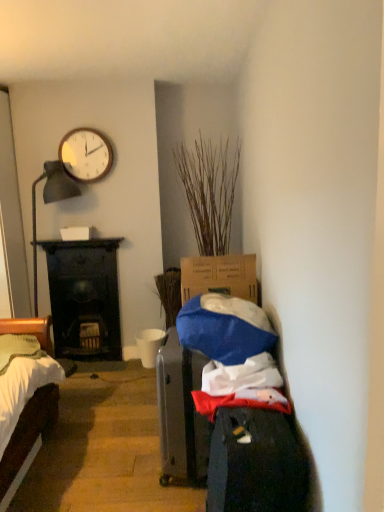
What do you see at coordinates (86, 155) in the screenshot? I see `wooden clock at upper left` at bounding box center [86, 155].

Where is `dark wood fireplace at left`? This screenshot has height=512, width=384. dark wood fireplace at left is located at coordinates (84, 295).

The width and height of the screenshot is (384, 512). Find the location of `wooden clock at upper left`. wooden clock at upper left is located at coordinates (86, 155).

In terms of height, does white matte cup at center look taller or shorter compared to dark wood fireplace at left?

In the image, white matte cup at center appears to be shorter than dark wood fireplace at left.

Is the surface of white matte cup at center in direct contact with dark wood fireplace at left?

No, white matte cup at center is not in contact with dark wood fireplace at left.

How different are the orientations of white matte cup at center and dark wood fireplace at left in degrees?

The facing directions of white matte cup at center and dark wood fireplace at left are 0.512 degrees apart.

From the image's perspective, who appears lower, white matte cup at center or dark wood fireplace at left?

white matte cup at center, from the image's perspective.

Could you tell me if dark wood fireplace at left is turned towards wooden clock at upper left?

No, dark wood fireplace at left is not oriented towards wooden clock at upper left.

Is the surface of dark wood fireplace at left in direct contact with wooden clock at upper left?

No, dark wood fireplace at left is not making contact with wooden clock at upper left.

Does dark wood fireplace at left appear on the left side of wooden clock at upper left?

Indeed, dark wood fireplace at left is positioned on the left side of wooden clock at upper left.

Is dark wood fireplace at left wider or thinner than wooden clock at upper left?

Considering their sizes, dark wood fireplace at left looks broader than wooden clock at upper left.

Which is more to the left, wooden clock at upper left or dry wood plant at center?

From the viewer's perspective, wooden clock at upper left appears more on the left side.

Who is taller, wooden clock at upper left or dry wood plant at center?

dry wood plant at center.

Considering the sizes of objects wooden clock at upper left and dry wood plant at center in the image provided, who is smaller, wooden clock at upper left or dry wood plant at center?

Smaller between the two is wooden clock at upper left.

You are a GUI agent. You are given a task and a screenshot of the screen. Output one action in this format:
    pyautogui.click(x=<x>, y=<y>)
    Task: Click on the plant that appears in front of the wooden clock at upper left
    
    Given the screenshot: What is the action you would take?
    (209, 191)

From the image's perspective, is wooden clock at upper left located above dark wood fireplace at left?

Yes, from the image's perspective, wooden clock at upper left is above dark wood fireplace at left.

Is wooden clock at upper left shorter than dark wood fireplace at left?

Yes.

From a real-world perspective, who is located lower, wooden clock at upper left or dark wood fireplace at left?

dark wood fireplace at left is physically lower.

Which is more to the left, wooden clock at upper left or dark wood fireplace at left?

dark wood fireplace at left.

Considering the sizes of objects dry wood plant at center and white matte cup at center in the image provided, who is taller, dry wood plant at center or white matte cup at center?

Standing taller between the two is dry wood plant at center.

Could you tell me if dry wood plant at center is facing white matte cup at center?

No, dry wood plant at center does not turn towards white matte cup at center.

Between dry wood plant at center and white matte cup at center, which one is positioned behind?

white matte cup at center is behind.

Is dry wood plant at center beside white matte cup at center?

No, dry wood plant at center is not with white matte cup at center.

Looking at this image, considering the sizes of objects dry wood plant at center and wooden clock at upper left in the image provided, who is taller, dry wood plant at center or wooden clock at upper left?

dry wood plant at center is taller.

From a real-world perspective, which is physically below, dry wood plant at center or wooden clock at upper left?

dry wood plant at center.

How different are the orientations of dry wood plant at center and wooden clock at upper left in degrees?

0.426 degrees.

Is dry wood plant at center completely or partially outside of wooden clock at upper left?

dry wood plant at center is positioned outside wooden clock at upper left.

Does point (77, 306) appear closer or farther from the camera than point (215, 226)?

Point (77, 306).

Does dark wood fireplace at left touch dry wood plant at center?

dark wood fireplace at left and dry wood plant at center are clearly separated.

I want to click on plant in front of the dark wood fireplace at left, so click(209, 191).

Considering the sizes of objects dark wood fireplace at left and dry wood plant at center in the image provided, who is bigger, dark wood fireplace at left or dry wood plant at center?

dry wood plant at center.

This screenshot has height=512, width=384. Identify the location of bucket below the dark wood fireplace at left (from the image's perspective). (149, 345).

The width and height of the screenshot is (384, 512). In the image, there is a wooden clock at upper left. What are the coordinates of `desk below it (from a real-world perspective)` in the screenshot? It's located at (84, 295).

Which object lies nearer to the anchor point dry wood plant at center, dark wood fireplace at left or white matte cup at center?

dark wood fireplace at left.

In the scene shown: When comparing their distances from dry wood plant at center, does white matte cup at center or dark wood fireplace at left seem further?

Based on the image, white matte cup at center appears to be further to dry wood plant at center.

When comparing their distances from white matte cup at center, does wooden clock at upper left or dark wood fireplace at left seem closer?

Based on the image, dark wood fireplace at left appears to be nearer to white matte cup at center.

When comparing their distances from dark wood fireplace at left, does wooden clock at upper left or white matte cup at center seem closer?

white matte cup at center is closer to dark wood fireplace at left.

Considering their positions, is white matte cup at center positioned further to dry wood plant at center than wooden clock at upper left?

Based on the image, white matte cup at center appears to be further to dry wood plant at center.

Estimate the real-world distances between objects in this image. Which object is further from white matte cup at center, dark wood fireplace at left or wooden clock at upper left?

wooden clock at upper left is positioned further to the anchor white matte cup at center.

From the image, which object appears to be nearer to wooden clock at upper left, white matte cup at center or dark wood fireplace at left?

dark wood fireplace at left.

Which object lies nearer to the anchor point dark wood fireplace at left, white matte cup at center or wooden clock at upper left?

white matte cup at center is positioned closer to the anchor dark wood fireplace at left.

At what (x,y) coordinates should I click in order to perform the action: click on desk between wooden clock at upper left and white matte cup at center in the up-down direction. Please return your answer as a coordinate pair (x, y). Looking at the image, I should click on (84, 295).

The height and width of the screenshot is (512, 384). What are the coordinates of `plant between wooden clock at upper left and white matte cup at center in the vertical direction` in the screenshot? It's located at (209, 191).

Identify the location of plant between wooden clock at upper left and dark wood fireplace at left in the up-down direction. Image resolution: width=384 pixels, height=512 pixels. (209, 191).

Find the location of a particular element. The image size is (384, 512). bucket between dark wood fireplace at left and dry wood plant at center in the horizontal direction is located at coordinates (149, 345).